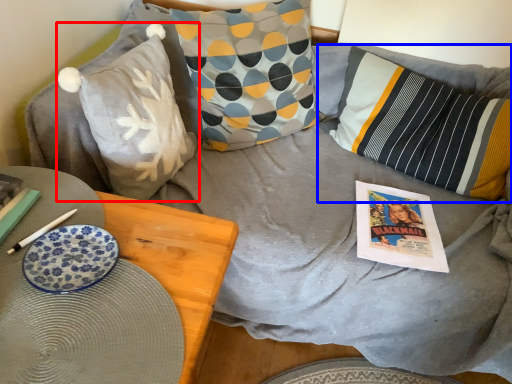
Question: Among these objects, which one is nearest to the camera, pillow (highlighted by a red box) or pillow (highlighted by a blue box)?

Choices:
 (A) pillow
 (B) pillow

Answer: (A)